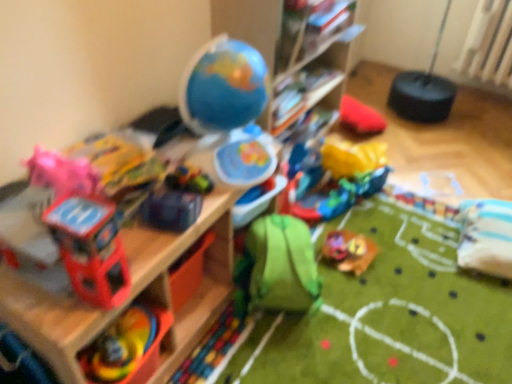
You are a GUI agent. You are given a task and a screenshot of the screen. Output one action in this format:
    pyautogui.click(x=<x>, y=<y>)
    Task: Click on the blank space situated above multicolored plastic toy at lower left, the fourth toy from the back (from a real-world perspective)
    The image size is (512, 384).
    Given the screenshot: What is the action you would take?
    pyautogui.click(x=106, y=342)